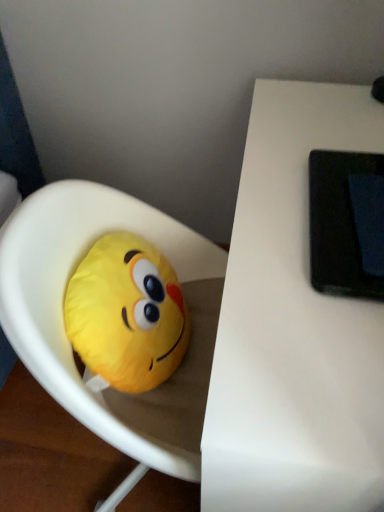
Question: Considering the relative sizes of white matte table at upper right and yellow plush toy at left, placed as the 1th toy when sorted from left to right, in the image provided, is white matte table at upper right thinner than yellow plush toy at left, placed as the 1th toy when sorted from left to right,?

Choices:
 (A) no
 (B) yes

Answer: (A)

Question: Is the surface of white matte table at upper right in direct contact with yellow plush toy at left, the 2th toy from the right?

Choices:
 (A) yes
 (B) no

Answer: (B)

Question: Does white matte table at upper right have a greater height compared to yellow plush toy at left, the 2th toy from the right?

Choices:
 (A) yes
 (B) no

Answer: (A)

Question: Can you confirm if white matte table at upper right is bigger than yellow plush toy at left, placed as the 1th toy when sorted from left to right?

Choices:
 (A) no
 (B) yes

Answer: (B)

Question: Is white matte table at upper right to the right of yellow plush toy at left, placed as the 1th toy when sorted from left to right, from the viewer's perspective?

Choices:
 (A) no
 (B) yes

Answer: (B)

Question: Can you confirm if white matte table at upper right is smaller than yellow plush toy at left, the 2th toy from the right?

Choices:
 (A) yes
 (B) no

Answer: (B)

Question: Would you say yellow plush toy at left, the 2th toy from the right, is outside black matte tablet at upper right?

Choices:
 (A) no
 (B) yes

Answer: (B)

Question: Does yellow plush toy at left, the 2th toy from the right, have a lesser height compared to black matte tablet at upper right?

Choices:
 (A) yes
 (B) no

Answer: (B)

Question: Is yellow plush toy at left, the 2th toy from the right, far away from black matte tablet at upper right?

Choices:
 (A) no
 (B) yes

Answer: (A)

Question: Is black matte tablet at upper right at the back of yellow plush toy at left, placed as the 1th toy when sorted from left to right?

Choices:
 (A) no
 (B) yes

Answer: (A)

Question: Considering the relative sizes of yellow plush toy at left, the 2th toy from the right, and black matte tablet at upper right in the image provided, is yellow plush toy at left, the 2th toy from the right, taller than black matte tablet at upper right?

Choices:
 (A) no
 (B) yes

Answer: (B)

Question: Is yellow plush toy at left, the 2th toy from the right, thinner than black matte tablet at upper right?

Choices:
 (A) yes
 (B) no

Answer: (A)

Question: Is yellow fabric emoji pillow at left, marked as the 2th toy in a left-to-right arrangement, at the right side of yellow plush toy at left, placed as the 1th toy when sorted from left to right?

Choices:
 (A) no
 (B) yes

Answer: (B)